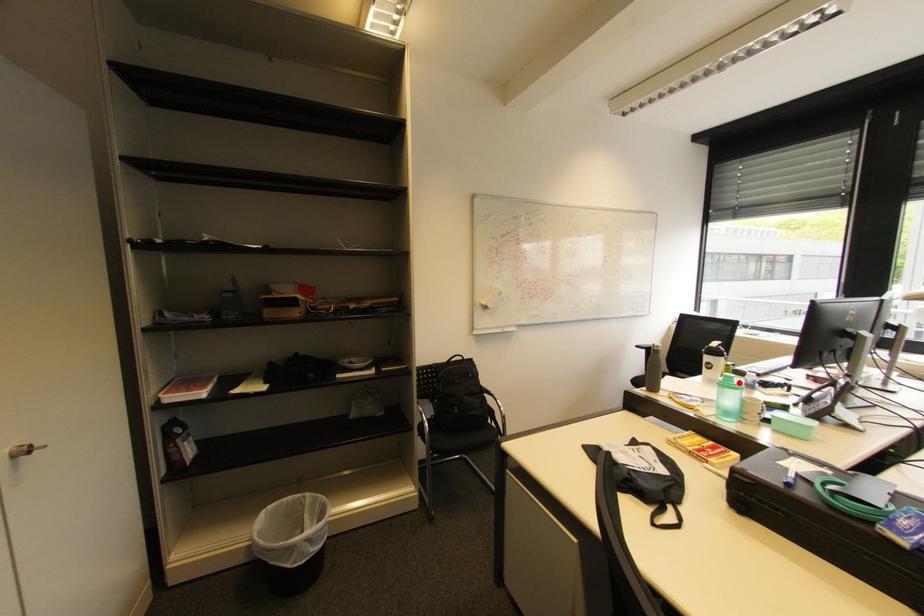
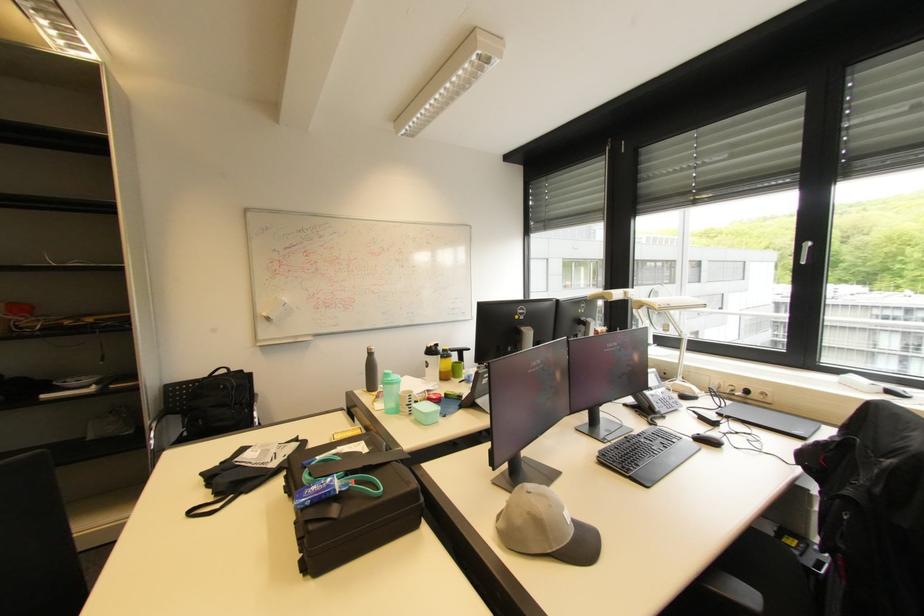
Where in the second image is the point corresponding to the highlighted location from the first image?

(394, 379)